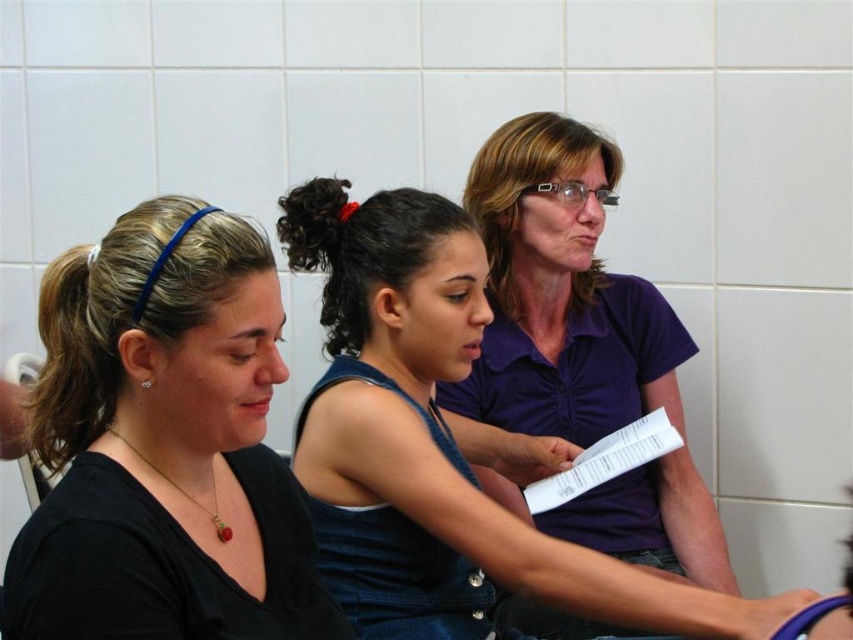
Consider the image. You are standing in the same room as the three people. The black matte shirt at center and the brown hair at left are both in your line of sight. Which object is closer to you?

The black matte shirt at center is closer to the viewer than the brown hair at left.

You are standing in the waiting area and notice two people wearing the black matte shirt at center and denim at center. Which clothing item is positioned in front of the other?

The black matte shirt at center is closer to the viewer than the denim at center, so it is positioned in front of the denim at center.